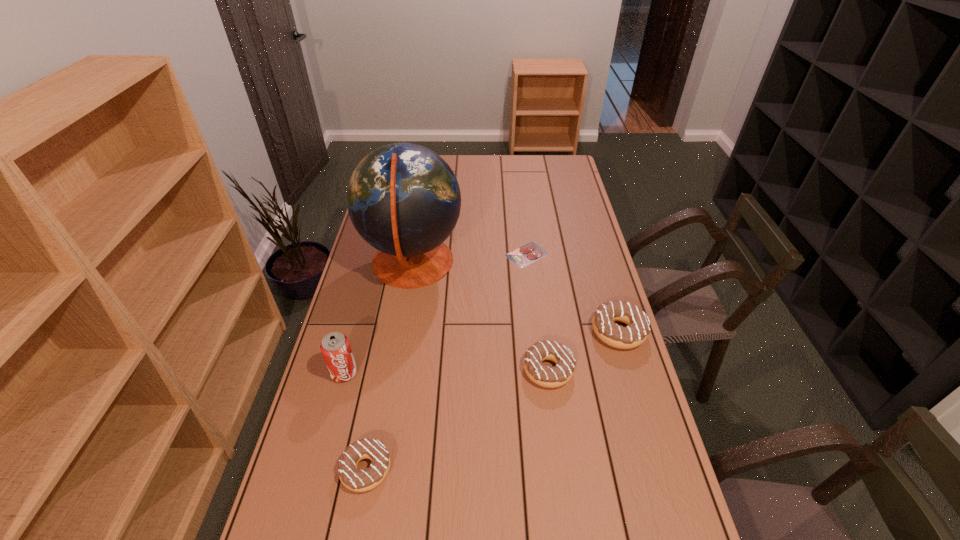
This screenshot has width=960, height=540. Identify the location of free region located 0.390m on the left of the rightmost object. (469, 332).

Identify the location of vacant space situated 0.050m on the front of the shortest object. This screenshot has width=960, height=540. (529, 278).

This screenshot has width=960, height=540. Identify the location of vacant space located 0.400m with the Americas facing the viewer on the globe. (569, 264).

Locate an element on the screen. The width and height of the screenshot is (960, 540). vacant region located 0.350m on the right of the soda can is located at coordinates (476, 373).

At what (x,y) coordinates should I click in order to perform the action: click on doughnut located in the left edge section of the desktop. Please return your answer as a coordinate pair (x, y). The height and width of the screenshot is (540, 960). Looking at the image, I should click on (356, 480).

Find the location of `globe located in the left edge section of the desktop`. globe located in the left edge section of the desktop is located at coordinates (403, 199).

Locate an element on the screen. The height and width of the screenshot is (540, 960). soda can located in the left edge section of the desktop is located at coordinates (335, 347).

What are the coordinates of `object that is at the right edge` in the screenshot? It's located at (638, 323).

In the image, there is a desktop. At what (x,y) coordinates should I click in order to perform the action: click on vacant space at the far edge. Please return your answer as a coordinate pair (x, y). This screenshot has width=960, height=540. Looking at the image, I should click on (457, 156).

Locate an element on the screen. free space at the near edge of the desktop is located at coordinates coord(406,504).